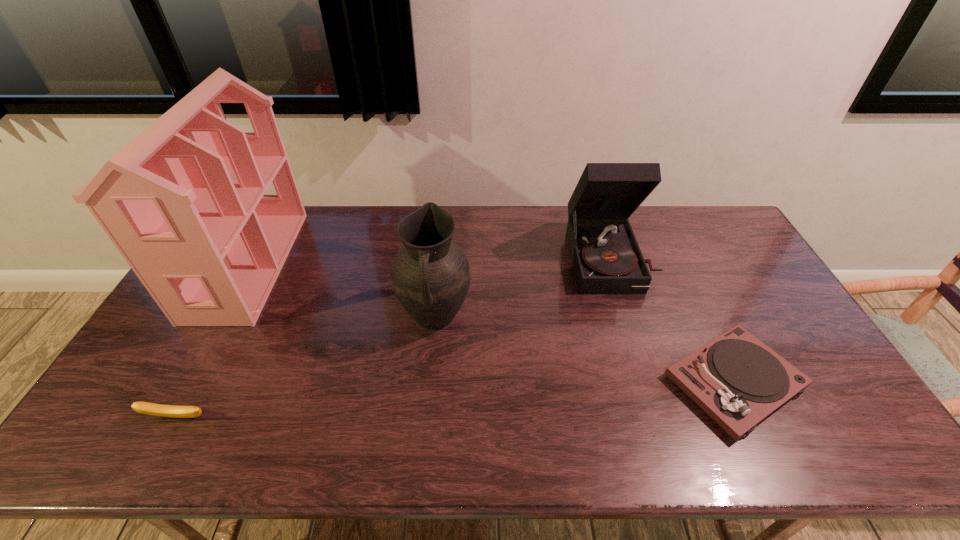
Locate an element on the screen. blank space at the far edge of the desktop is located at coordinates (412, 208).

The height and width of the screenshot is (540, 960). I want to click on vacant space at the near edge of the desktop, so click(x=303, y=442).

In the image, there is a desktop. Identify the location of vacant space at the far right corner. (691, 217).

Where is `free spot between the pitcher and the tallest object`? free spot between the pitcher and the tallest object is located at coordinates pos(342,291).

Image resolution: width=960 pixels, height=540 pixels. I want to click on blank region between the third object from left to right and the tallest object, so click(342, 291).

The image size is (960, 540). What are the coordinates of `free spot between the tallest object and the third object from right to left` in the screenshot? It's located at (342, 291).

You are a GUI agent. You are given a task and a screenshot of the screen. Output one action in this format:
    pyautogui.click(x=<x>, y=<y>)
    Task: Click on the vacant area between the banana and the nearer phonograph_record
    This screenshot has height=540, width=960.
    Given the screenshot: What is the action you would take?
    tap(455, 400)

Find the location of a particular element. free area in between the taller phonograph_record and the shorter phonograph_record is located at coordinates (672, 320).

You are a GUI agent. You are given a task and a screenshot of the screen. Output one action in this format:
    pyautogui.click(x=<x>, y=<y>)
    Task: Click on the unoccupied area between the pitcher and the banana
    The image size is (960, 540).
    Given the screenshot: What is the action you would take?
    pyautogui.click(x=306, y=367)

Identify the location of vacant area between the pitcher and the nearer phonograph_record. The width and height of the screenshot is (960, 540). (585, 349).